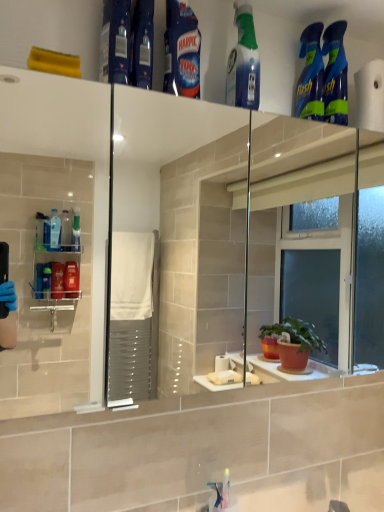
Question: Is blue glossy spray bottles at upper right, which ranks as the second cleaning product in right-to-left order, in front of or behind blue glossy spray bottle at upper left, which is the fifth cleaning product in right-to-left order, in the image?

Choices:
 (A) behind
 (B) front

Answer: (A)

Question: From the image's perspective, is blue glossy spray bottles at upper right, which ranks as the second cleaning product in right-to-left order, positioned above or below blue glossy spray bottle at upper left, which is the fifth cleaning product in right-to-left order?

Choices:
 (A) above
 (B) below

Answer: (B)

Question: Which is nearer to the translucent plastic spray bottle at upper center, the third cleaning product viewed from the left?

Choices:
 (A) blue glossy spray bottles at upper right, which ranks as the second cleaning product in right-to-left order
 (B) blue plastic bottle at upper center
 (C) blue glossy harpic at upper center, marked as the 4th cleaning product in a right-to-left arrangement
 (D) white matte toilet paper at upper right
 (E) blue glossy spray bottle at upper left, positioned as the first cleaning product in left-to-right order

Answer: (C)

Question: Which of these objects is positioned farthest from the blue glossy spray bottle at upper left, positioned as the first cleaning product in left-to-right order?

Choices:
 (A) translucent plastic spray bottle at upper center, acting as the third cleaning product starting from the right
 (B) blue plastic bottle at upper center
 (C) blue glossy spray bottles at upper right, which is the 1th cleaning product from right to left
 (D) white matte toilet paper at upper right
 (E) blue glossy spray bottles at upper right, the 4th cleaning product positioned from the left

Answer: (D)